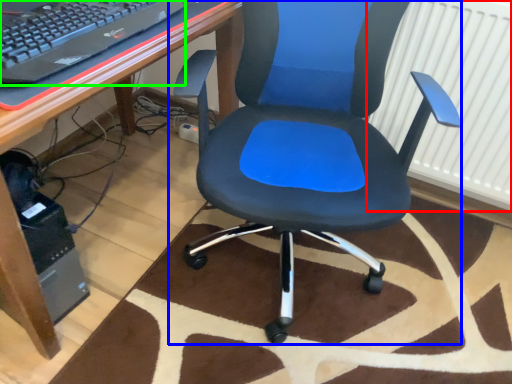
Question: Considering the real-world distances, which object is farthest from radiator (highlighted by a red box)? chair (highlighted by a blue box) or computer keyboard (highlighted by a green box)?

Choices:
 (A) chair
 (B) computer keyboard

Answer: (B)